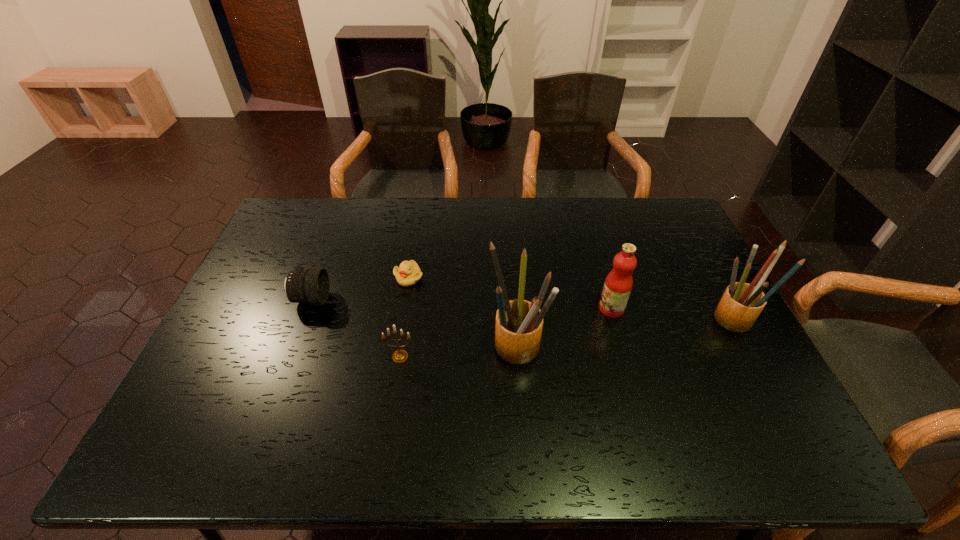
Where is `the fourth object from left to right`? This screenshot has width=960, height=540. the fourth object from left to right is located at coordinates (519, 323).

I want to click on the left pencil box, so click(x=519, y=323).

This screenshot has width=960, height=540. In order to click on the right pencil box in this screenshot , I will do 741,304.

Where is `the rightmost object`? This screenshot has width=960, height=540. the rightmost object is located at coordinates (741, 304).

Where is `candelabrum`? Image resolution: width=960 pixels, height=540 pixels. candelabrum is located at coordinates (399, 356).

Find the location of a particular element. The height and width of the screenshot is (540, 960). the second shortest object is located at coordinates (306, 286).

You are a GUI agent. You are given a task and a screenshot of the screen. Output one action in this format:
    pyautogui.click(x=<x>, y=<y>)
    Task: Click on the telephoto lens
    The height and width of the screenshot is (540, 960).
    Given the screenshot: What is the action you would take?
    pyautogui.click(x=306, y=286)

Identify the location of fruit juice. This screenshot has width=960, height=540. (618, 284).

Where is `the shortest object`? This screenshot has width=960, height=540. the shortest object is located at coordinates (408, 273).

Find the location of a particular element. The image size is (960, 540). blank space located on the left of the tallest object is located at coordinates (459, 347).